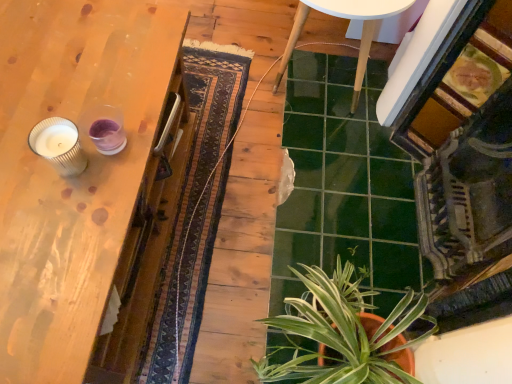
In order to face ridged glass candle at left, should I rotate leftwards or rightwards?

To face it directly, rotate left by 23.695 degrees.

Where is `white glossy table at center`? This screenshot has width=512, height=384. white glossy table at center is located at coordinates (346, 18).

Find the location of a particular element. The image size is (512, 384). ridged glass candle at left is located at coordinates (58, 145).

Who is bigger, green glossy plant at lower right or white glossy table at center?

With larger size is white glossy table at center.

From the picture: What's the angular difference between green glossy plant at lower right and white glossy table at center's facing directions?

The facing directions of green glossy plant at lower right and white glossy table at center are 2.46 degrees apart.

From a real-world perspective, is green glossy plant at lower right on white glossy table at center?

No.

Which object is thinner, green glossy plant at lower right or white glossy table at center?

Thinner between the two is white glossy table at center.

Which of these two, wooden table at left or green glossy plant at lower right, is smaller?

green glossy plant at lower right is smaller.

From a real-world perspective, who is located higher, wooden table at left or green glossy plant at lower right?

wooden table at left, from a real-world perspective.

How different are the orientations of wooden table at left and green glossy plant at lower right in degrees?

87.3 degrees separate the facing orientations of wooden table at left and green glossy plant at lower right.

Based on the photo, between ridged glass candle at left and white glossy table at center, which one has less height?

With less height is ridged glass candle at left.

From a real-world perspective, is ridged glass candle at left above or below white glossy table at center?

Clearly, from a real-world perspective, ridged glass candle at left is above white glossy table at center.

From the image's perspective, is ridged glass candle at left under white glossy table at center?

Yes.

Is wooden table at left at the back of white glossy table at center?

white glossy table at center does not have its back to wooden table at left.

Consider the image. Measure the distance from white glossy table at center to wooden table at left.

white glossy table at center is 78.18 centimeters away from wooden table at left.

From a real-world perspective, is white glossy table at center positioned above or below wooden table at left?

white glossy table at center is below wooden table at left.

Looking at this image, is white glossy table at center wider or thinner than wooden table at left?

Clearly, white glossy table at center has less width compared to wooden table at left.

Does white glossy table at center have a lesser width compared to ridged glass candle at left?

In fact, white glossy table at center might be wider than ridged glass candle at left.

From a real-world perspective, is white glossy table at center positioned under ridged glass candle at left based on gravity?

Yes, from a real-world perspective, white glossy table at center is below ridged glass candle at left.

Is white glossy table at center at the right side of ridged glass candle at left?

Yes.

From the image's perspective, would you say white glossy table at center is positioned over ridged glass candle at left?

Yes, from the image's perspective, white glossy table at center is on top of ridged glass candle at left.

Is wooden table at left in front of or behind ridged glass candle at left in the image?

Visually, wooden table at left is located in front of ridged glass candle at left.

Could you tell me if wooden table at left is facing ridged glass candle at left?

No, wooden table at left is not turned towards ridged glass candle at left.

From the image's perspective, is wooden table at left above or below ridged glass candle at left?

Based on their image positions, wooden table at left is located beneath ridged glass candle at left.

Does point (30, 251) come closer to viewer compared to point (82, 152)?

Yes, point (30, 251) is in front of point (82, 152).

Based on the photo, is white glossy table at center at the right side of green glossy plant at lower right?

Yes.

In the scene shown: Would you consider white glossy table at center to be distant from green glossy plant at lower right?

No, white glossy table at center is not far away from green glossy plant at lower right.

Is white glossy table at center facing away from green glossy plant at lower right?

white glossy table at center is not turned away from green glossy plant at lower right.

Find the location of a particular element. This screenshot has height=384, width=512. houseplant that appears below the white glossy table at center (from a real-world perspective) is located at coordinates (342, 333).

The width and height of the screenshot is (512, 384). I want to click on houseplant beneath the white glossy table at center (from a real-world perspective), so (x=342, y=333).

In order to click on houseplant on the right of wooden table at left in this screenshot , I will do `click(342, 333)`.

Which object lies further to the anchor point white glossy table at center, ridged glass candle at left or wooden table at left?

Based on the image, ridged glass candle at left appears to be further to white glossy table at center.

Considering their positions, is ridged glass candle at left positioned closer to green glossy plant at lower right than white glossy table at center?

ridged glass candle at left is closer to green glossy plant at lower right.

Which object lies further to the anchor point ridged glass candle at left, white glossy table at center or green glossy plant at lower right?

white glossy table at center is further to ridged glass candle at left.

Which object lies nearer to the anchor point wooden table at left, green glossy plant at lower right or ridged glass candle at left?

ridged glass candle at left.

Estimate the real-world distances between objects in this image. Which object is further from white glossy table at center, green glossy plant at lower right or ridged glass candle at left?

ridged glass candle at left is further to white glossy table at center.

When comparing their distances from white glossy table at center, does green glossy plant at lower right or wooden table at left seem further?

green glossy plant at lower right lies further to white glossy table at center than the other object.

Considering their positions, is white glossy table at center positioned closer to green glossy plant at lower right than wooden table at left?

The object closer to green glossy plant at lower right is wooden table at left.

Based on their spatial positions, is ridged glass candle at left or green glossy plant at lower right closer to white glossy table at center?

The object closer to white glossy table at center is green glossy plant at lower right.

You are a GUI agent. You are given a task and a screenshot of the screen. Output one action in this format:
    pyautogui.click(x=<x>, y=<y>)
    Task: Click on the table between white glossy table at center and green glossy plant at lower right in the up-down direction
    This screenshot has width=512, height=384.
    Given the screenshot: What is the action you would take?
    pyautogui.click(x=74, y=179)

Locate an element on the screen. candle holder between wooden table at left and green glossy plant at lower right from left to right is located at coordinates (58, 145).

Locate an element on the screen. This screenshot has width=512, height=384. candle holder between white glossy table at center and green glossy plant at lower right in the vertical direction is located at coordinates (58, 145).

Where is `candle holder situated between wooden table at left and white glossy table at center from left to right`? The height and width of the screenshot is (384, 512). candle holder situated between wooden table at left and white glossy table at center from left to right is located at coordinates (58, 145).